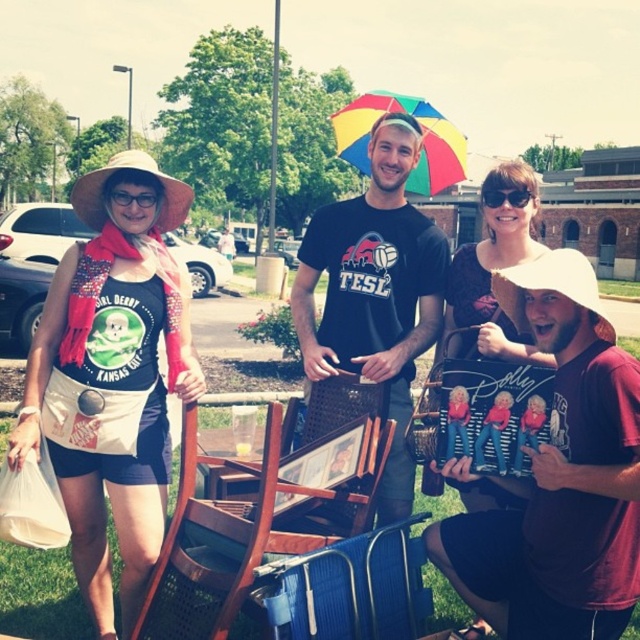
Question: From the image, what is the correct spatial relationship of maroon cotton shirt at lower right in relation to black cotton t-shirt at center?

Choices:
 (A) right
 (B) left

Answer: (A)

Question: Is the position of matte black tank top at center less distant than that of wooden chair at center?

Choices:
 (A) no
 (B) yes

Answer: (A)

Question: In this image, where is wooden chair at center located relative to wooden chair at lower right?

Choices:
 (A) above
 (B) below

Answer: (B)

Question: Which point is closer to the camera?

Choices:
 (A) (410, 452)
 (B) (358, 272)

Answer: (A)

Question: Which is farther from the rainbow fabric umbrella at center?

Choices:
 (A) wooden chair at lower right
 (B) blue fabric chair at lower center
 (C) black plastic goggles at upper center
 (D) wooden chair at center

Answer: (D)

Question: Which of these objects is positioned closest to the maroon cotton shirt at lower right?

Choices:
 (A) blue fabric chair at lower center
 (B) black plastic goggles at upper center

Answer: (A)